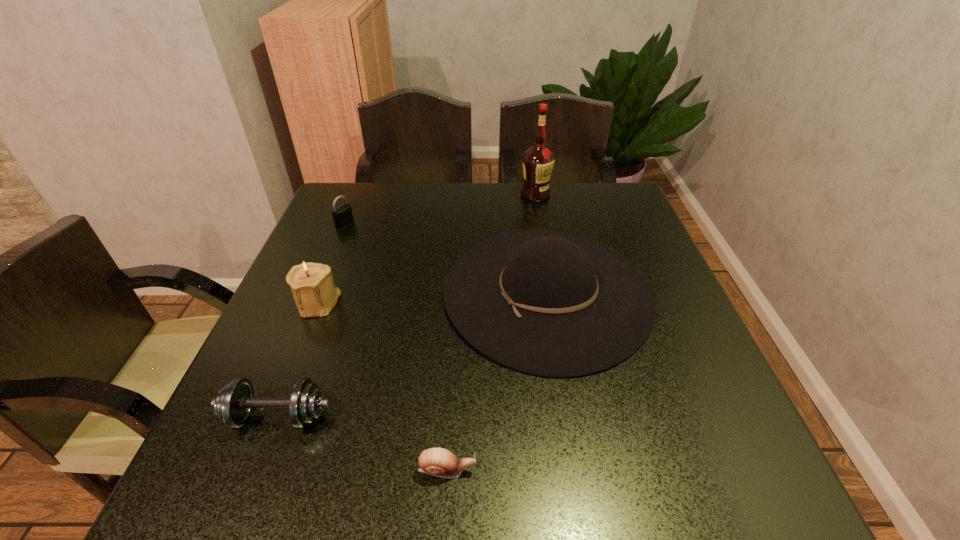
Where is `vacant area situated on the front-facing side of the sombrero`? The width and height of the screenshot is (960, 540). vacant area situated on the front-facing side of the sombrero is located at coordinates (353, 293).

The width and height of the screenshot is (960, 540). What are the coordinates of `vacant space situated on the front-facing side of the sombrero` in the screenshot? It's located at (400, 293).

I want to click on vacant space located on the back of the candle_holder, so click(345, 236).

This screenshot has width=960, height=540. In order to click on vacant space located on the right of the padlock in this screenshot , I will do `click(416, 224)`.

You are a GUI agent. You are given a task and a screenshot of the screen. Output one action in this format:
    pyautogui.click(x=<x>, y=<y>)
    Task: Click on the vacant space positioned 0.120m on the front-facing side of the nearest object
    
    Given the screenshot: What is the action you would take?
    [550, 470]

Where is `alcohol present at the far edge`? alcohol present at the far edge is located at coordinates (538, 160).

At what (x,y) coordinates should I click in order to perform the action: click on padlock that is at the far edge. Please return your answer as a coordinate pair (x, y). This screenshot has height=540, width=960. Looking at the image, I should click on (342, 216).

What are the coordinates of `object that is at the near edge` in the screenshot? It's located at (436, 461).

Where is `candle_holder that is positioned at the left edge`? This screenshot has width=960, height=540. candle_holder that is positioned at the left edge is located at coordinates (312, 285).

At what (x,y) coordinates should I click in order to perform the action: click on padlock that is at the left edge. Please return your answer as a coordinate pair (x, y). This screenshot has height=540, width=960. Looking at the image, I should click on (342, 216).